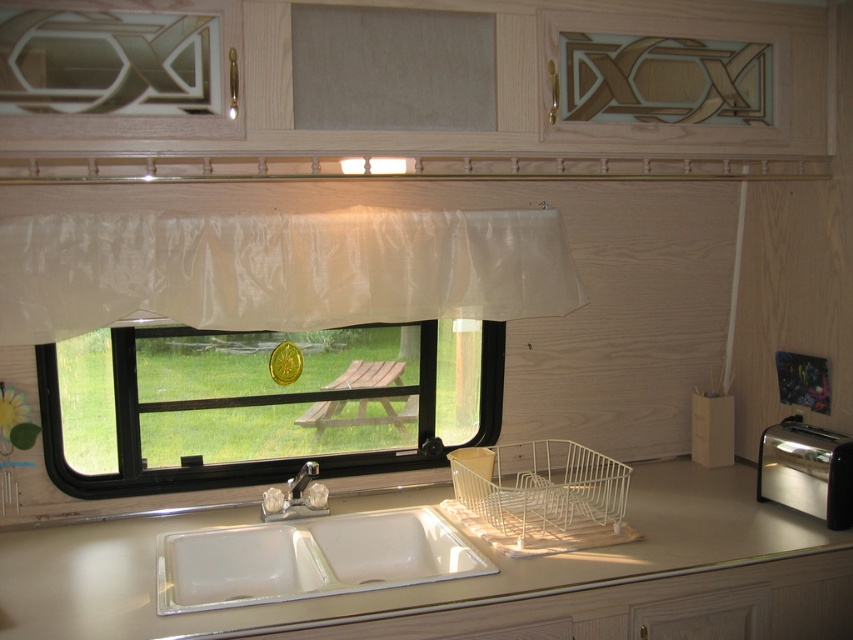
Question: Is the position of white laminate counter top at center less distant than that of black plastic window at center?

Choices:
 (A) yes
 (B) no

Answer: (A)

Question: Is translucent white curtain at upper center bigger than clear crystal faucet at center?

Choices:
 (A) no
 (B) yes

Answer: (B)

Question: Among these points, which one is nearest to the camera?

Choices:
 (A) (376, 548)
 (B) (306, 515)
 (C) (761, 593)
 (D) (213, 356)

Answer: (C)

Question: Which point appears farthest from the camera in this image?

Choices:
 (A) (762, 620)
 (B) (312, 472)
 (C) (473, 228)
 (D) (836, 483)

Answer: (C)

Question: Which of these objects is positioned closest to the white laminate counter top at center?

Choices:
 (A) white ceramic sink at center
 (B) satin silver toaster at right
 (C) silver metallic faucet at sink center
 (D) clear crystal faucet at center

Answer: (A)

Question: From the image, what is the correct spatial relationship of black plastic window at center in relation to white ceramic sink at center?

Choices:
 (A) left
 (B) right

Answer: (A)